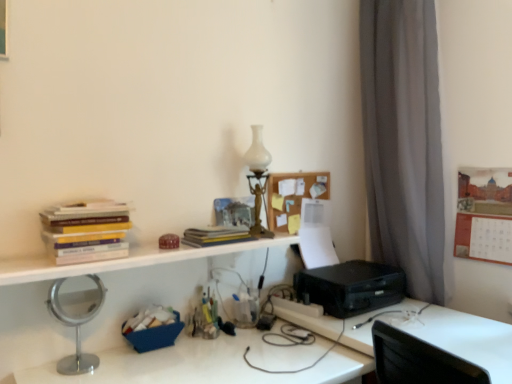
This screenshot has width=512, height=384. I want to click on vacant area that lies between hardcover books at upper left and matte brown box at center, which is the third stationery in bottom-to-top order, so click(x=150, y=252).